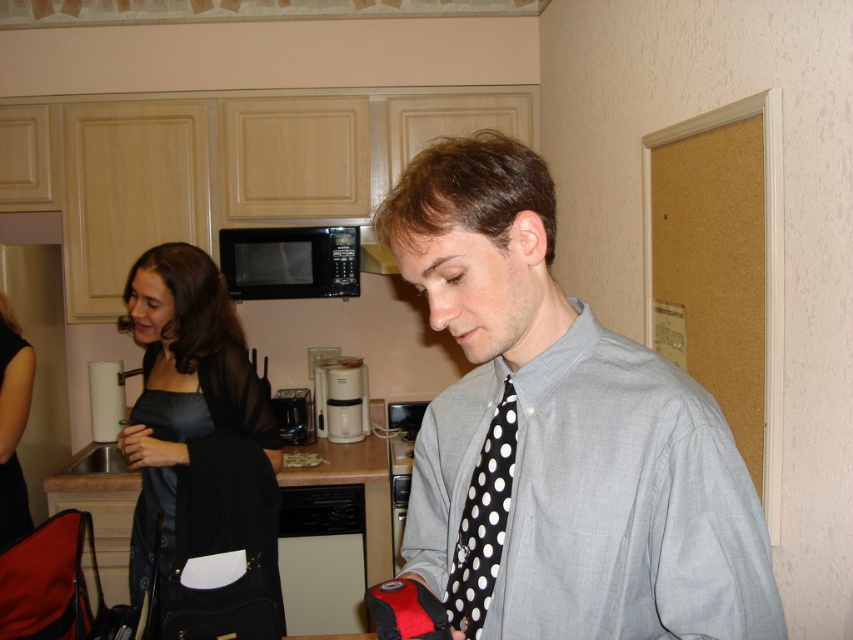
You are organizing a kitchen inventory and need to compare the width of the black dotted fabric tie at center and the black matte microwave at upper center. Which one is wider?

The black matte microwave at upper center is wider than the black dotted fabric tie at center.

You are a guest in this kitchen and see both the black satin dress at center and the white plastic coffee machine at center. Which object is nearer to you?

The black satin dress at center is closer to the viewer than the white plastic coffee machine at center.

You are a delivery person who just arrived at a house to drop off a package. You notice two items on the kitchen counter in the image provided. Which item is wider between the black satin dress at center and the white plastic coffee machine at center?

The black satin dress at center is wider than the white plastic coffee machine at center according to the description.